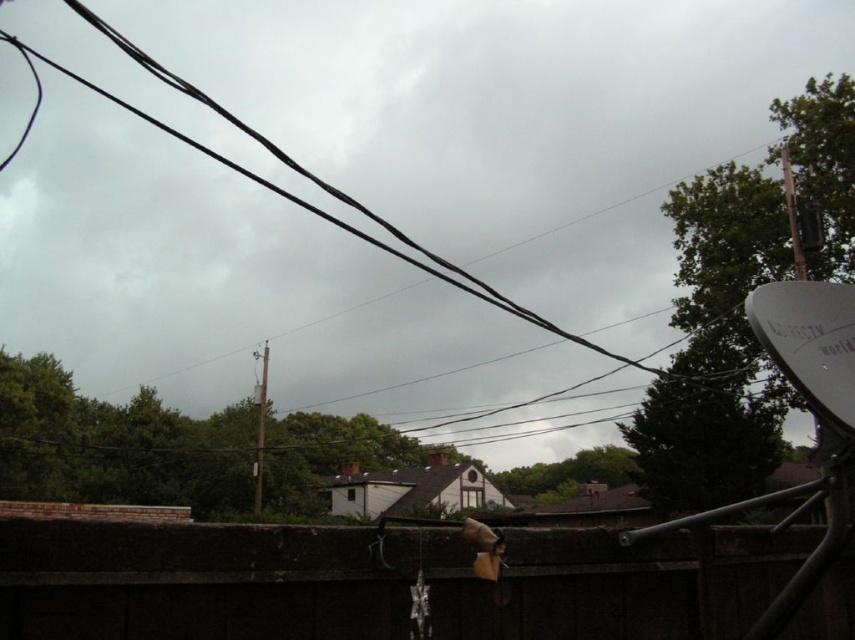
Who is lower down, black wire at upper center or brown wooden fence at lower center?

brown wooden fence at lower center is below.

Who is more forward, (68, 212) or (16, 596)?

Point (16, 596) is in front.

Where is `black wire at upper center`? This screenshot has width=855, height=640. black wire at upper center is located at coordinates (500, 122).

Which is behind, point (634, 259) or point (257, 404)?

Positioned behind is point (634, 259).

Can you confirm if black wire at upper center is positioned to the right of smooth gray pole at center?

No, black wire at upper center is not to the right of smooth gray pole at center.

Find the location of `black wire at upper center`. black wire at upper center is located at coordinates (500, 122).

This screenshot has width=855, height=640. In order to click on black wire at upper center in this screenshot , I will do `click(500, 122)`.

Is brown wooden fence at lower center shorter than smooth gray pole at center?

Yes.

Does brown wooden fence at lower center appear on the right side of smooth gray pole at center?

Indeed, brown wooden fence at lower center is positioned on the right side of smooth gray pole at center.

At what (x,y) coordinates should I click in order to perform the action: click on brown wooden fence at lower center. Please return your answer as a coordinate pair (x, y). Looking at the image, I should click on [379, 582].